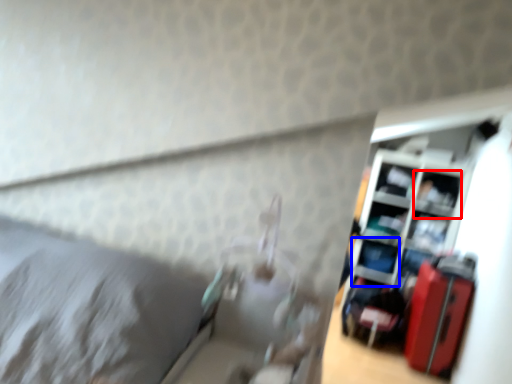
Question: Which point is further to the camera, shelf (highlighted by a red box) or shelf (highlighted by a blue box)?

Choices:
 (A) shelf
 (B) shelf

Answer: (B)